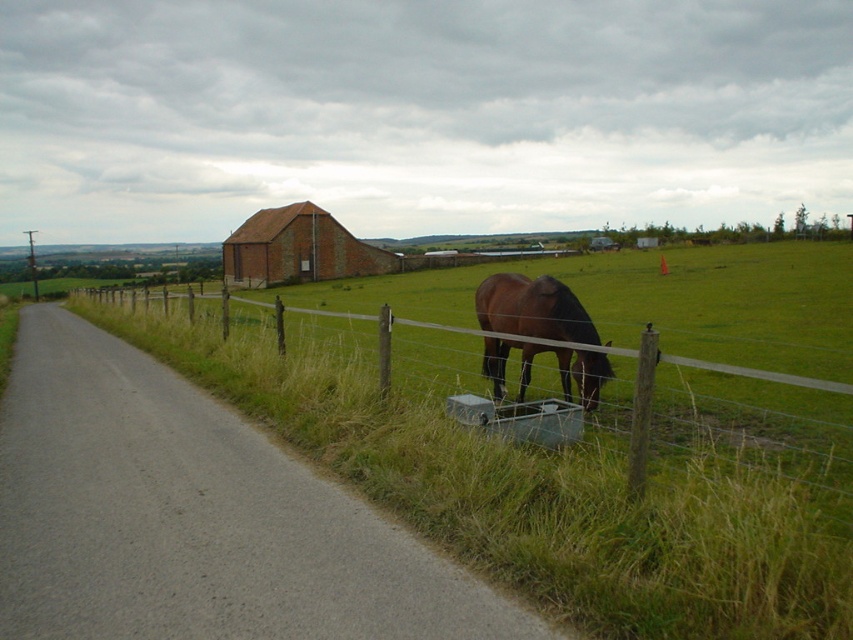
Question: Is wire mesh fence at lower right to the left of brick red barn at center from the viewer's perspective?

Choices:
 (A) yes
 (B) no

Answer: (B)

Question: Which point appears closest to the camera in this image?

Choices:
 (A) (320, 209)
 (B) (495, 388)

Answer: (B)

Question: Estimate the real-world distances between objects in this image. Which object is farther from the brown glossy horse at center?

Choices:
 (A) brick red barn at center
 (B) wire mesh fence at lower right

Answer: (A)

Question: Where is wire mesh fence at lower right located in relation to brown glossy horse at center in the image?

Choices:
 (A) above
 (B) below

Answer: (A)

Question: Among these points, which one is nearest to the camera?

Choices:
 (A) (247, 364)
 (B) (305, 273)

Answer: (A)

Question: Observing the image, what is the correct spatial positioning of wire mesh fence at lower right in reference to brown glossy horse at center?

Choices:
 (A) right
 (B) left

Answer: (B)